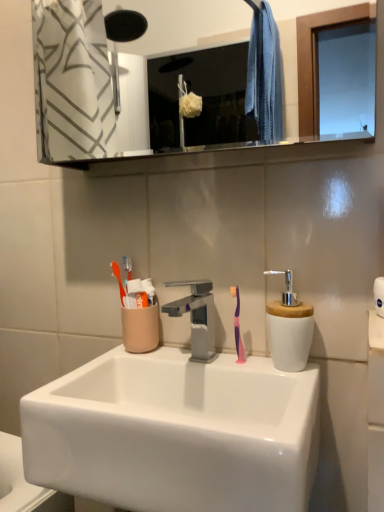
I want to click on free region on the left part of satin nickel faucet at center, so click(98, 368).